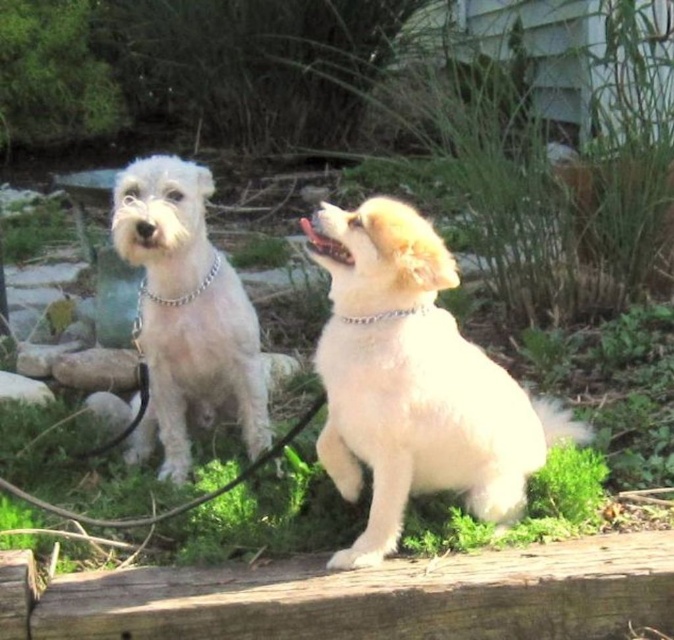
Question: Which object appears farthest from the camera in this image?

Choices:
 (A) fluffy white dog at center
 (B) white fluffy dog at left
 (C) silver metallic chain at upper center

Answer: (B)

Question: Among these objects, which one is farthest from the camera?

Choices:
 (A) silver metallic chain at upper center
 (B) white fluffy dog at left

Answer: (B)

Question: Does fluffy white dog at center appear on the right side of silver metallic chain at upper center?

Choices:
 (A) no
 (B) yes

Answer: (B)

Question: Does fluffy white dog at center have a larger size compared to silver metallic chain at upper center?

Choices:
 (A) yes
 (B) no

Answer: (A)

Question: Which point is closer to the camera?

Choices:
 (A) white fluffy dog at left
 (B) fluffy white dog at center

Answer: (B)

Question: Does silver chain at left come behind silver metallic chain at upper center?

Choices:
 (A) yes
 (B) no

Answer: (A)